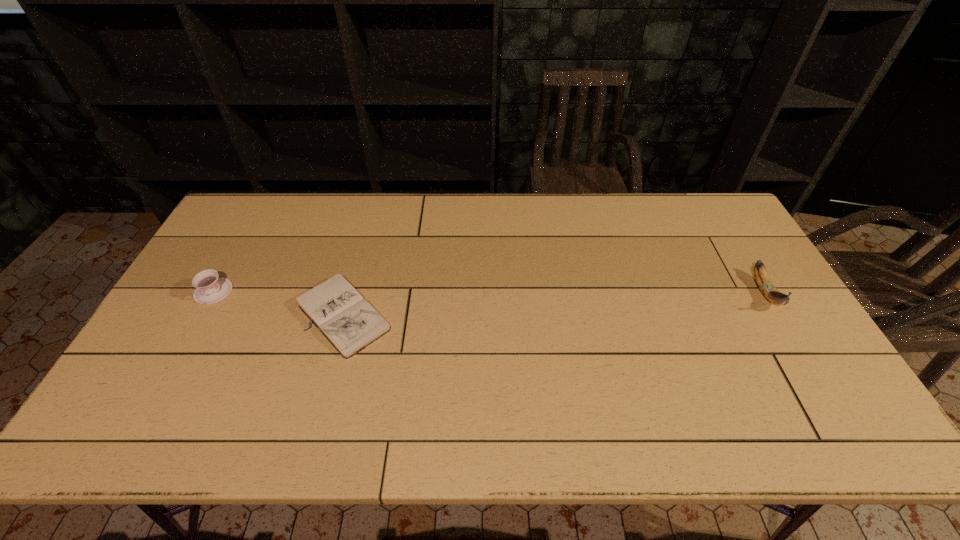
Where is `free location that satisfies the following two spatial constraints: 1. on the handle side of the teacup; 2. on the right side of the shortest object`? The image size is (960, 540). free location that satisfies the following two spatial constraints: 1. on the handle side of the teacup; 2. on the right side of the shortest object is located at coordinates (201, 314).

I want to click on vacant space that satisfies the following two spatial constraints: 1. on the handle side of the leftmost object; 2. on the left side of the second object from left to right, so click(201, 314).

Locate an element on the screen. vacant area in the image that satisfies the following two spatial constraints: 1. on the handle side of the second tallest object; 2. on the left side of the notebook is located at coordinates pos(201,314).